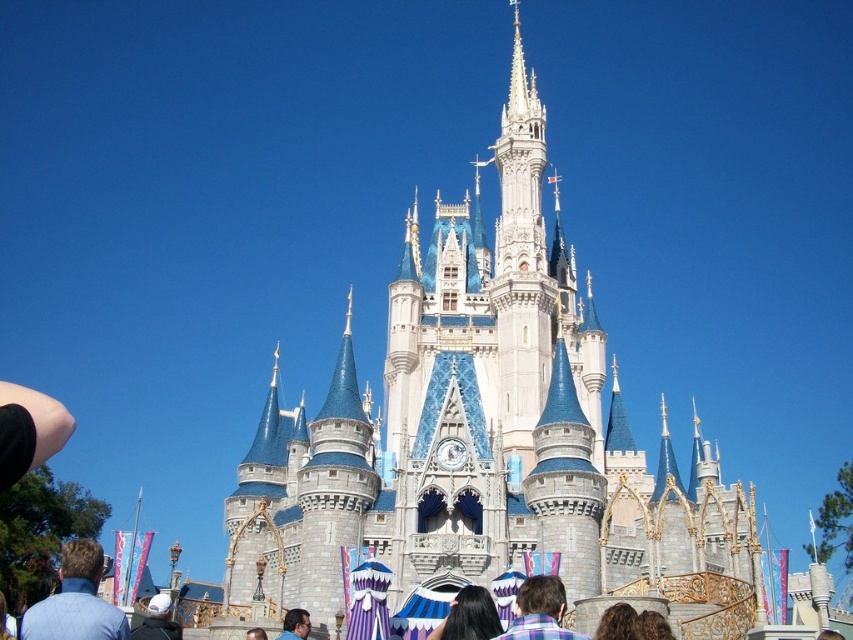
Question: Which object is the farthest from the white matte helmet at lower left?

Choices:
 (A) white stone castle at center
 (B) blue shirt at lower left
 (C) plaid fabric shirt at lower center
 (D) black hair at center

Answer: (A)

Question: Is white stone castle at center bigger than white matte helmet at lower left?

Choices:
 (A) yes
 (B) no

Answer: (A)

Question: Which of the following is the farthest from the observer?

Choices:
 (A) black hair at center
 (B) white stone castle at center
 (C) blue fabric headscarf at center

Answer: (B)

Question: Which object appears farthest from the camera in this image?

Choices:
 (A) white stone castle at center
 (B) blue shirt at lower left
 (C) white matte helmet at lower left
 (D) black hair at center

Answer: (C)

Question: Where is plaid fabric shirt at lower center located in relation to white matte helmet at lower left in the image?

Choices:
 (A) below
 (B) above

Answer: (B)

Question: Does blue shirt at lower left appear on the right side of black hair at center?

Choices:
 (A) no
 (B) yes

Answer: (A)